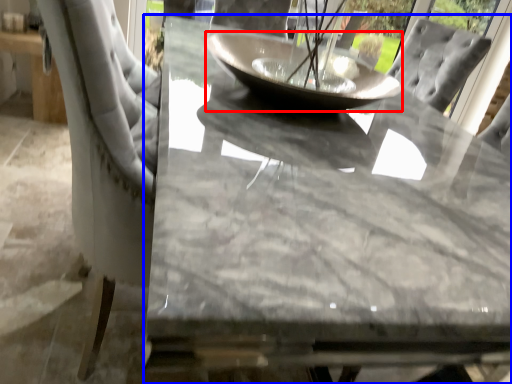
Question: Which object appears farthest to the camera in this image, glass bowl (highlighted by a red box) or table (highlighted by a blue box)?

Choices:
 (A) glass bowl
 (B) table

Answer: (A)